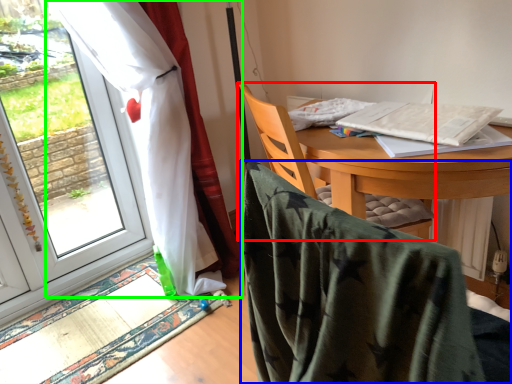
Question: Which is nearer to the chair (highlighted by a red box)? chair (highlighted by a blue box) or curtain (highlighted by a green box).

Choices:
 (A) chair
 (B) curtain

Answer: (A)